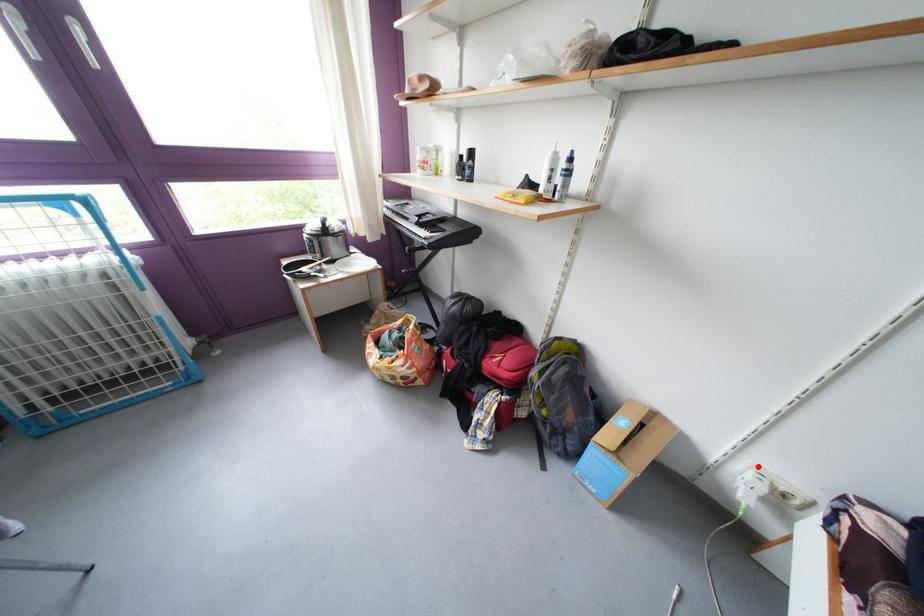
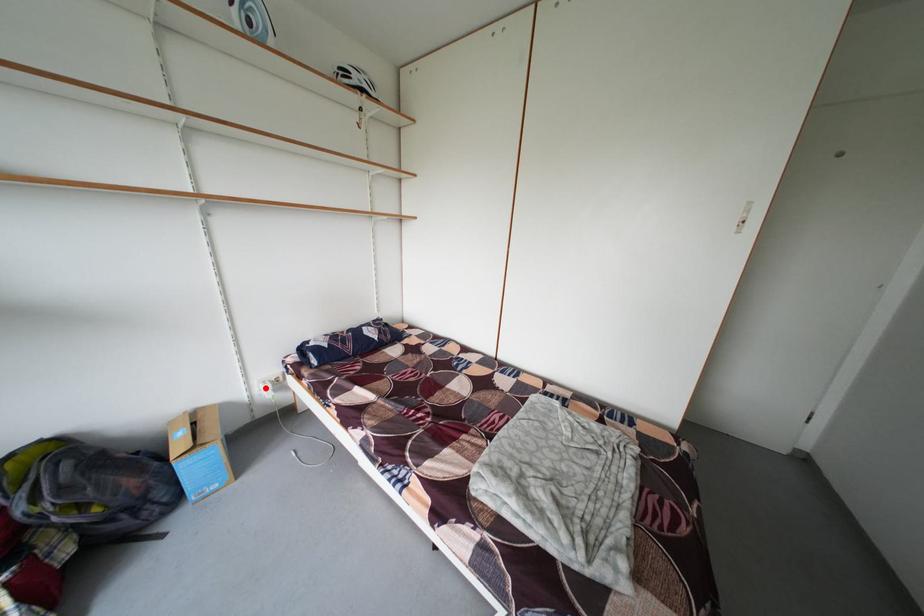
I am providing you with two images of the same scene from different viewpoints. A red point is marked on the first image and another point is marked on the second image. Is the marked point in image1 the same physical position as the marked point in image2?

Yes